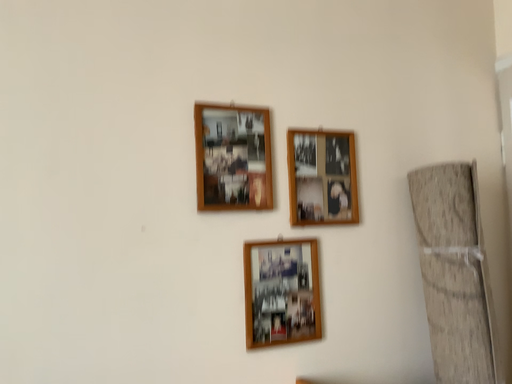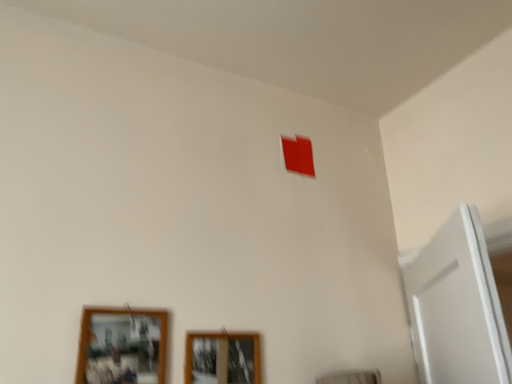
Question: How did the camera likely rotate when shooting the video?

Choices:
 (A) rotated downward
 (B) rotated upward

Answer: (B)